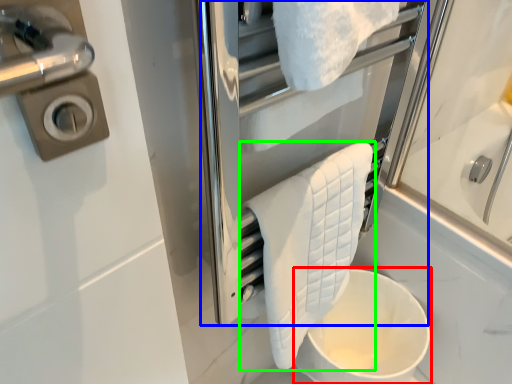
Question: Based on their relative distances, which object is nearer to toilet bowl (highlighted by a red box)? Choose from screen door (highlighted by a blue box) and towel (highlighted by a green box).

Choices:
 (A) screen door
 (B) towel

Answer: (B)